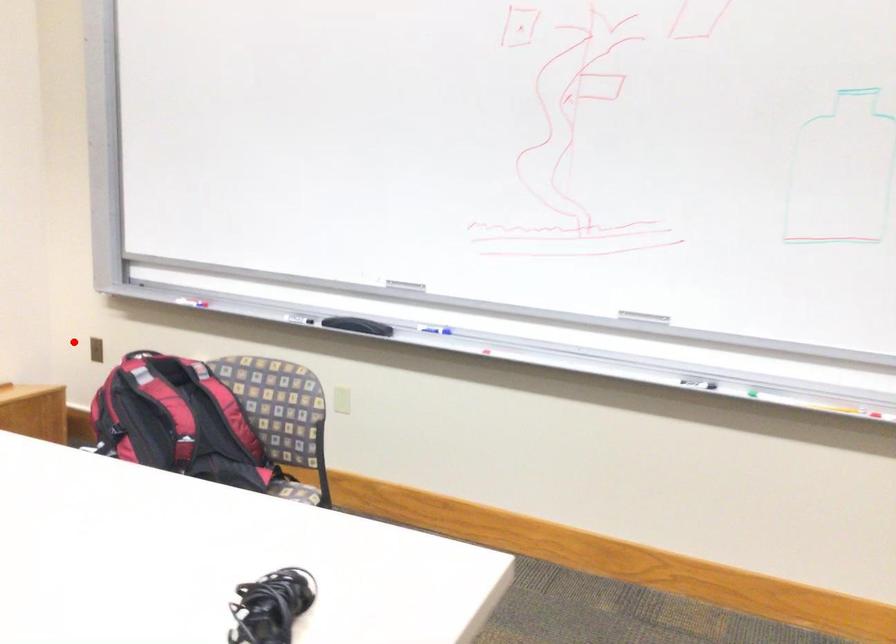
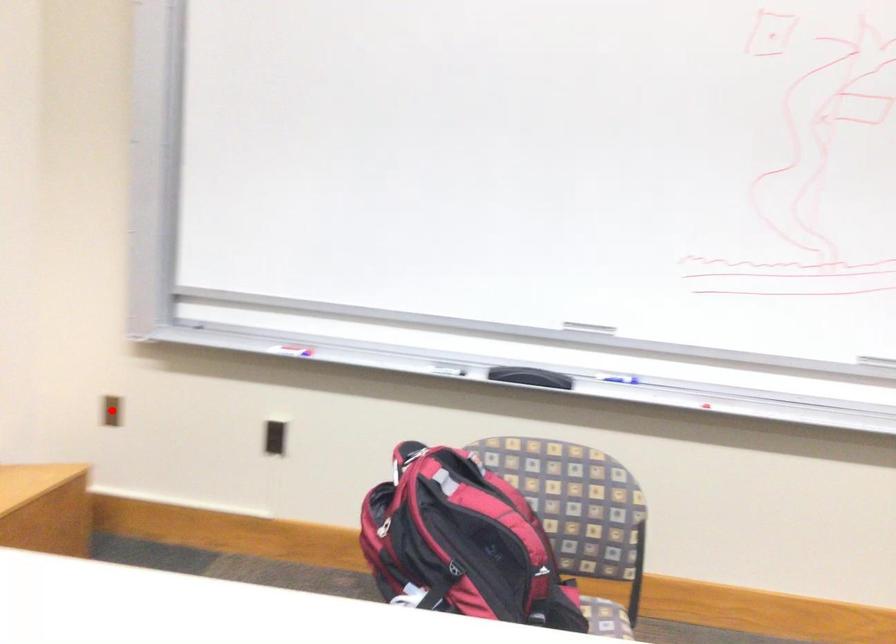
I am providing you with two images of the same scene from different viewpoints. A red point is marked on the first image and another point is marked on the second image. Does the point marked in image1 correspond to the same location as the one in image2?

Yes